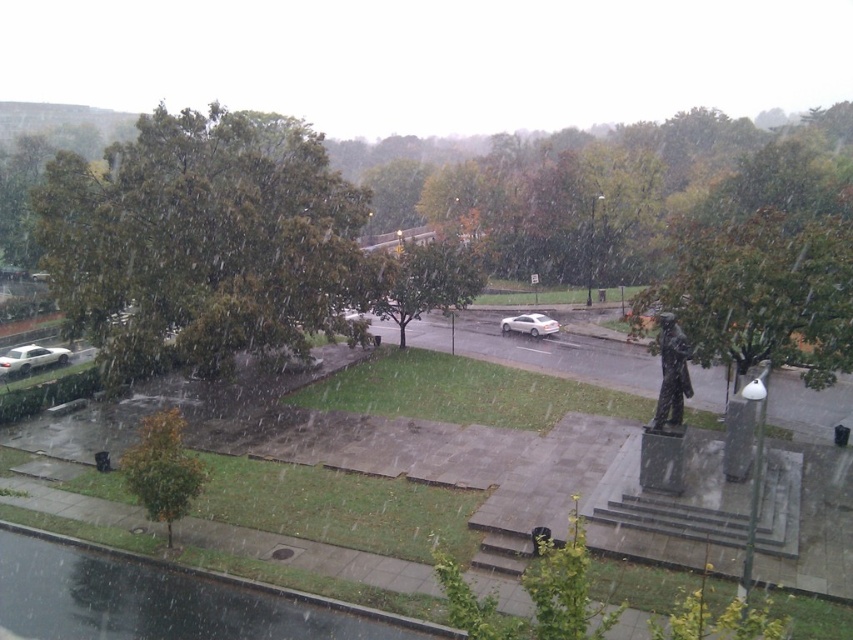
You are standing in the park and want to take a photo of both the green leafy tree at center and the green matte tree at lower left. Which tree should you move closer to in order to capture both in the same frame?

You should move closer to the green matte tree at lower left because the green leafy tree at center is closer to you, so moving towards the farther tree would help include both in the frame.